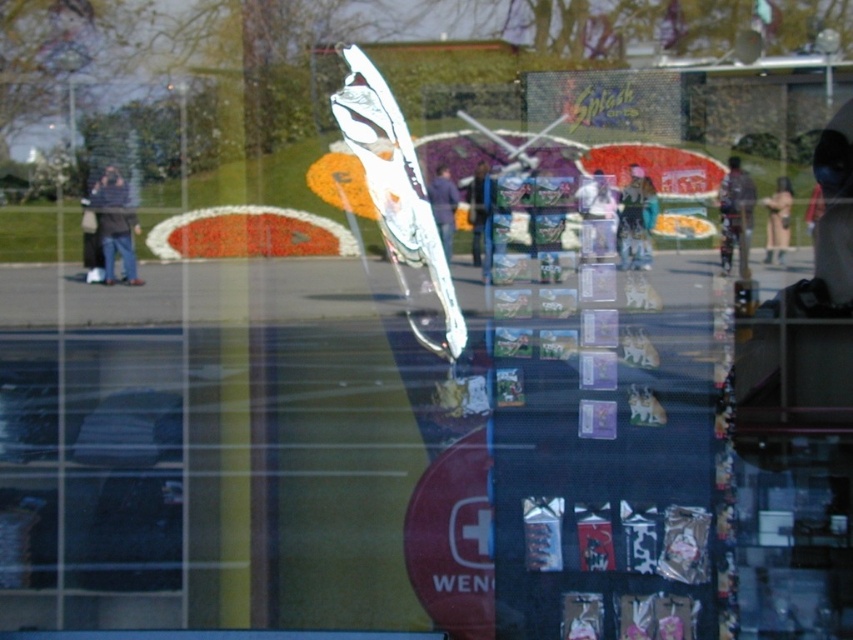
You are trying to decide which item to grab quickly in case of an emergency. The camouflage jacket at right and the dark blue jeans at center are both within reach. Which one is larger and easier to grab?

The camouflage jacket at right is bigger than the dark blue jeans at center, so it is easier to grab.

You are standing in a room with a window that reflects both the inside and outside. You see a camouflage jacket at right and dark blue jeans at left. Which object is taller?

The camouflage jacket at right is taller than the dark blue jeans at left.

You are trying to decide whether to wear the light brown leather jacket at right and the dark blue jeans at center together. Based on their sizes, will the jacket be longer than the jeans when worn?

The light brown leather jacket at right is not as tall as dark blue jeans at center, so the jacket will be shorter than the jeans when worn.